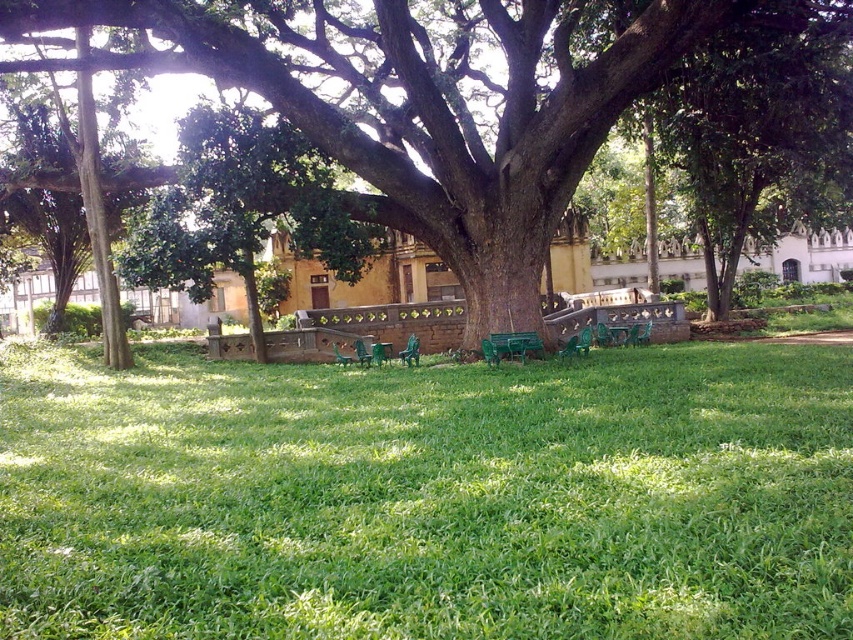
Which is more to the left, green textured tree at center or green plastic bench at center?

green textured tree at center is more to the left.

Is point (434, 225) positioned behind point (532, 353)?

Yes, it is behind point (532, 353).

Is point (302, 44) positioned in front of point (498, 336)?

No, (302, 44) is further to viewer.

At what (x,y) coordinates should I click in order to perform the action: click on green textured tree at center. Please return your answer as a coordinate pair (x, y). Looking at the image, I should click on (433, 99).

Who is more forward, (538, 340) or (399, 355)?

Positioned in front is point (538, 340).

Which is more to the right, green plastic bench at center or green plastic chair at center?

Positioned to the right is green plastic bench at center.

This screenshot has height=640, width=853. I want to click on green plastic bench at center, so [x=515, y=344].

Which is more to the right, green grassy at center or green plastic chair at center?

Positioned to the right is green plastic chair at center.

Based on the photo, which is more to the left, green grassy at center or green plastic chair at center?

From the viewer's perspective, green grassy at center appears more on the left side.

Is point (438, 406) farther from viewer compared to point (408, 342)?

No, it is in front of (408, 342).

Identify the location of green grassy at center. (428, 497).